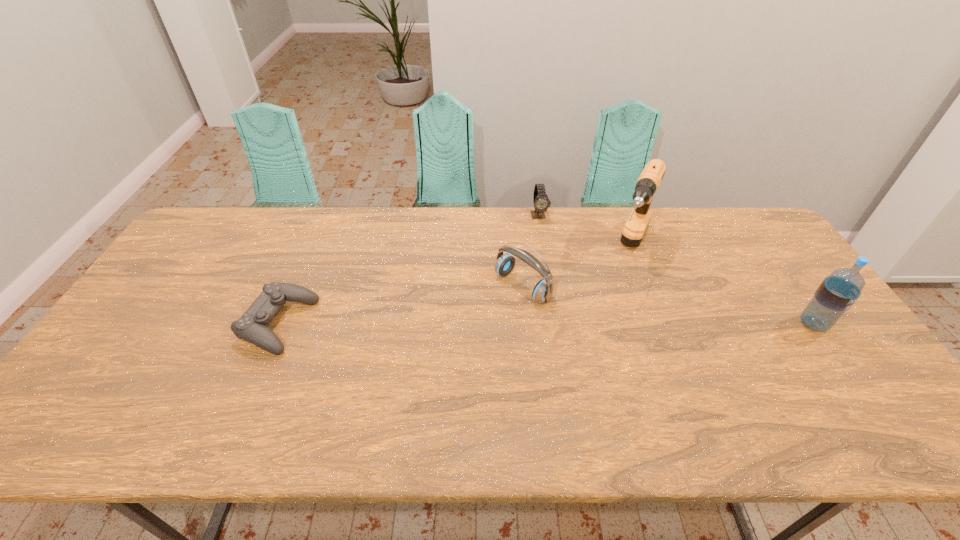
Where is `the shortest object`? the shortest object is located at coordinates (253, 325).

Where is `the leftmost object`? This screenshot has width=960, height=540. the leftmost object is located at coordinates (253, 325).

Where is `water bottle`? water bottle is located at coordinates (838, 292).

Find the location of a particular element. This screenshot has height=540, width=960. the fourth tallest object is located at coordinates pos(541,201).

This screenshot has width=960, height=540. What are the coordinates of `the second object from right to left` in the screenshot? It's located at (649, 180).

I want to click on the third tallest object, so click(543, 290).

Locate an element on the screen. The height and width of the screenshot is (540, 960). blank space located on the back of the leftmost object is located at coordinates (313, 244).

Locate an element on the screen. The image size is (960, 540). vacant space situated on the back of the rightmost object is located at coordinates (787, 287).

Locate an element on the screen. This screenshot has height=540, width=960. free space located 0.240m on the face of the watch is located at coordinates (554, 271).

The height and width of the screenshot is (540, 960). I want to click on vacant space located on the face of the watch, so click(564, 305).